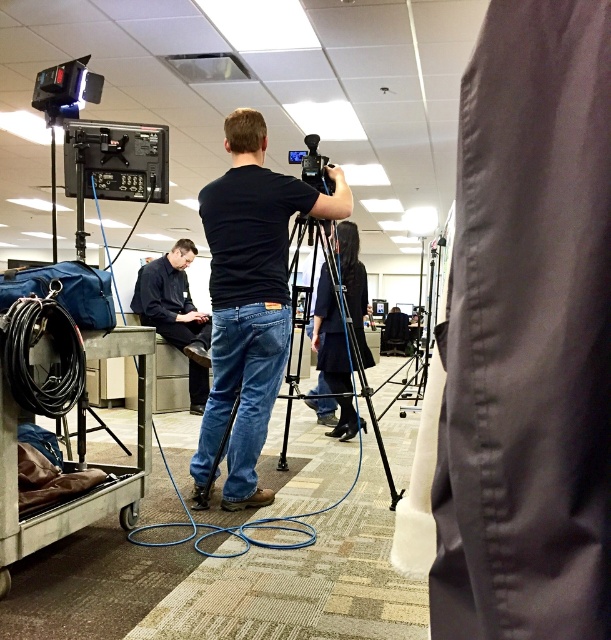
You are a camera operator in a newsroom. You need to move the camera closer to the black shirt at left. The camera requires at least 1 meter of space behind it to move. Is there enough space behind the camera to move it forward 4.80 meters?

The distance of black shirt at left from camera is 4.80 meters. Moving the camera forward 4.80 meters would bring it to the black shirt at left, but since the camera needs at least 1 meter of space behind it to move, there is insufficient space to perform this maneuver.

You are setting up a video shoot in the newsroom. You have a black matte camera at center and a black shirt at left. Which object takes up more horizontal space in the scene?

The black matte camera at center might be wider than black shirt at left according to the description.